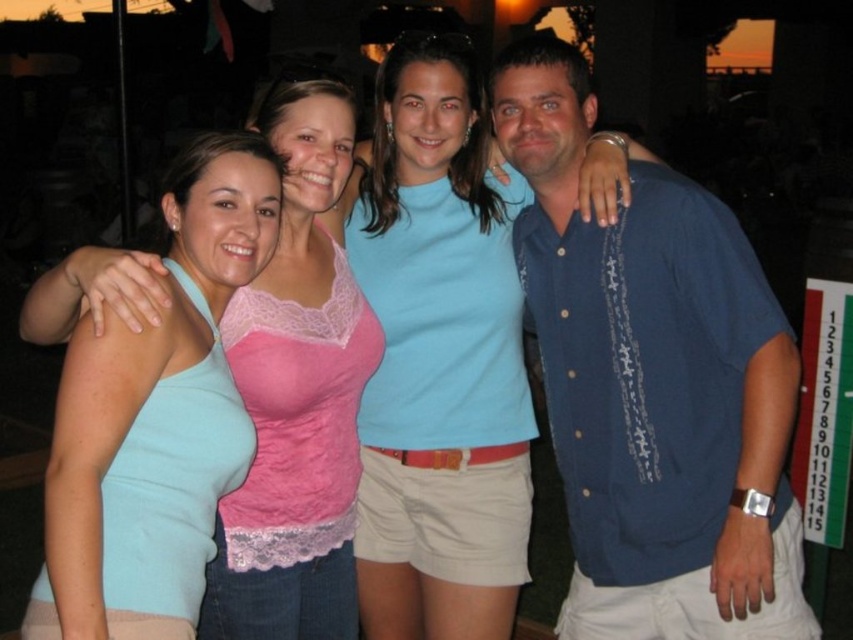
In the scene, there is a point at coordinates (653, 385). What object is located at this point?

The point at coordinates (653, 385) corresponds to the blue textured shirt at center.

You are taking a photo of the group and want to ensure that both the light blue cotton shirt at center and the light blue tank top at left are clearly visible. Based on their positions, which one is higher up in the frame?

The light blue cotton shirt at center is located above the light blue tank top at left, so it is higher up in the frame.